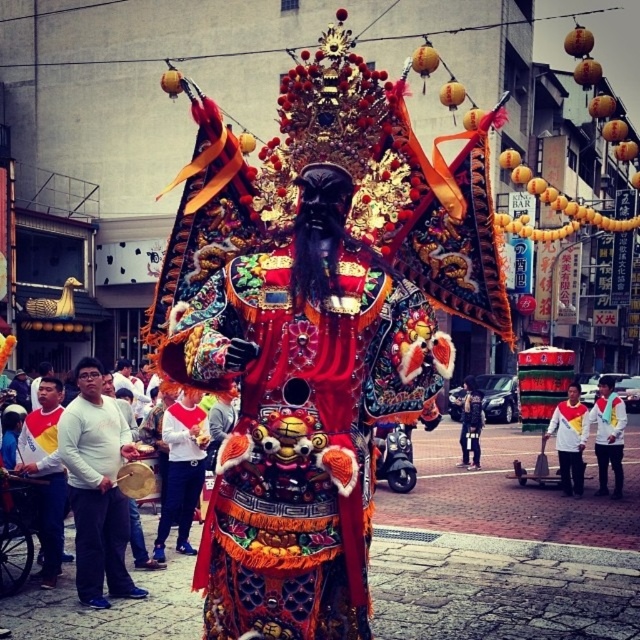
Between point (88, 524) and point (609, 461), which one is positioned behind?

The point (609, 461) is more distant.

Between white matte drum at left and white fabric shirt at center, which one is positioned higher?

white matte drum at left

The height and width of the screenshot is (640, 640). Find the location of `white matte drum at left`. white matte drum at left is located at coordinates (97, 486).

Is white matte drum at left to the right of white jersey at center from the viewer's perspective?

No, white matte drum at left is not to the right of white jersey at center.

Locate an element on the screen. The height and width of the screenshot is (640, 640). white matte drum at left is located at coordinates (97, 486).

Can you confirm if richly embroidered robe at center is bigger than white jersey at center?

No.

Can you confirm if richly embroidered robe at center is positioned above white jersey at center?

Yes, richly embroidered robe at center is above white jersey at center.

Where is `richly embroidered robe at center`? richly embroidered robe at center is located at coordinates (300, 429).